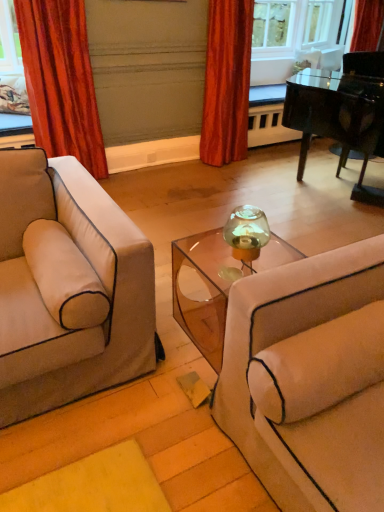
Question: Is velvet red curtain at upper center, the second curtain when ordered from left to right, inside or outside of velvet orange curtain at left, marked as the second curtain in a right-to-left arrangement?

Choices:
 (A) inside
 (B) outside

Answer: (B)

Question: Considering their positions, is velvet red curtain at upper center, the first curtain when ordered from right to left, located in front of or behind velvet orange curtain at left, placed as the 1th curtain when sorted from left to right?

Choices:
 (A) behind
 (B) front

Answer: (A)

Question: Estimate the real-world distances between objects in this image. Which object is farther from the velvet orange curtain at left, marked as the second curtain in a right-to-left arrangement?

Choices:
 (A) velvet red curtain at upper center, the second curtain when ordered from left to right
 (B) shiny black piano at upper right
 (C) beige fabric pillow at right
 (D) transparent acrylic table at center

Answer: (C)

Question: Based on their relative distances, which object is farther from the transparent acrylic table at center?

Choices:
 (A) shiny black piano at upper right
 (B) velvet red curtain at upper center, the second curtain when ordered from left to right
 (C) velvet orange curtain at left, placed as the 1th curtain when sorted from left to right
 (D) beige fabric pillow at right

Answer: (B)